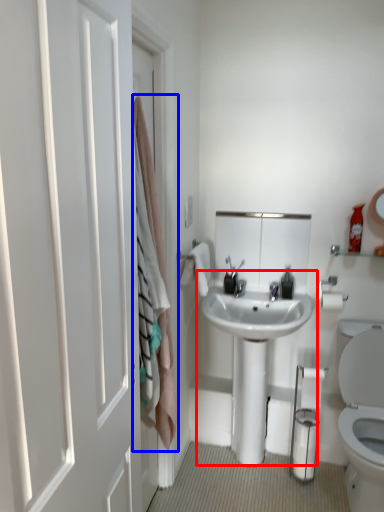
Question: Which object appears closest to the camera in this image, sink (highlighted by a red box) or curtain (highlighted by a blue box)?

Choices:
 (A) sink
 (B) curtain

Answer: (B)